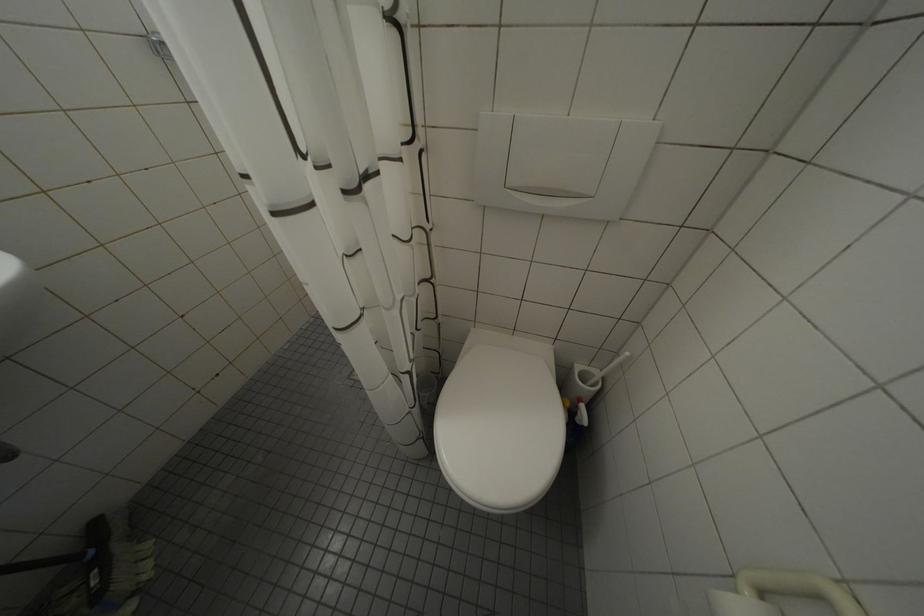
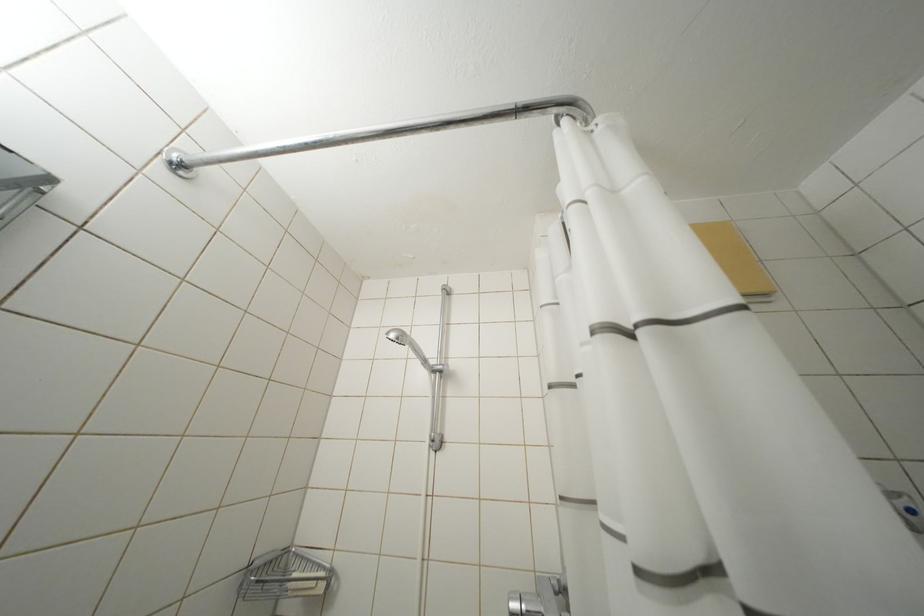
Consider the image. How did the camera likely rotate?

The camera's rotation is toward right-up.